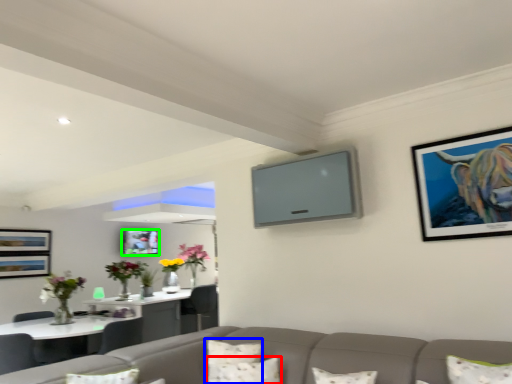
Question: Based on their relative distances, which object is farther from pillow (highlighted by a red box)? Choose from pillow (highlighted by a blue box) and picture frame (highlighted by a green box).

Choices:
 (A) pillow
 (B) picture frame

Answer: (B)